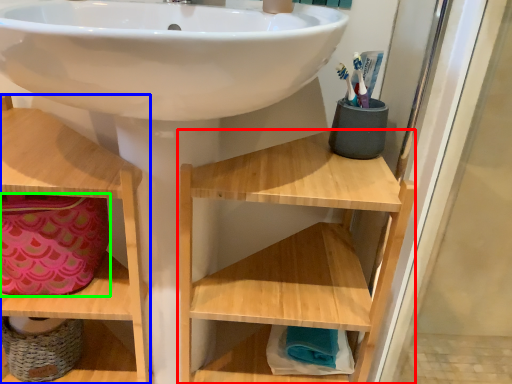
Question: Which object is the closest to the shelf (highlighted by a red box)? Choose among these: shelf (highlighted by a blue box) or material (highlighted by a green box).

Choices:
 (A) shelf
 (B) material

Answer: (A)